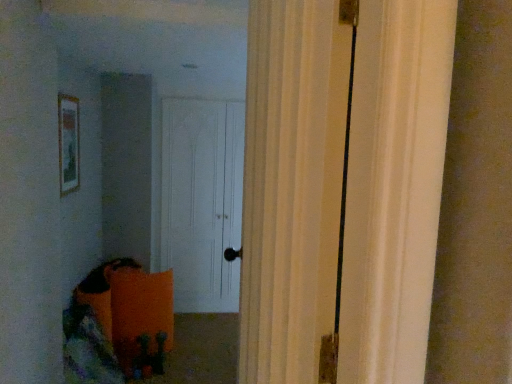
Question: From a real-world perspective, is white matte door at center above or below wooden framed picture at upper left?

Choices:
 (A) below
 (B) above

Answer: (A)

Question: From the image's perspective, relative to wooden framed picture at upper left, is white matte door at center above or below?

Choices:
 (A) above
 (B) below

Answer: (B)

Question: Is point (170, 254) closer or farther from the camera than point (66, 167)?

Choices:
 (A) farther
 (B) closer

Answer: (A)

Question: Is point [64, 192] positioned closer to the camera than point [176, 115]?

Choices:
 (A) farther
 (B) closer

Answer: (B)

Question: From the image's perspective, relative to white matte door at center, is wooden framed picture at upper left above or below?

Choices:
 (A) above
 (B) below

Answer: (A)

Question: In terms of size, does wooden framed picture at upper left appear bigger or smaller than white matte door at center?

Choices:
 (A) big
 (B) small

Answer: (B)

Question: Is wooden framed picture at upper left taller or shorter than white matte door at center?

Choices:
 (A) tall
 (B) short

Answer: (B)